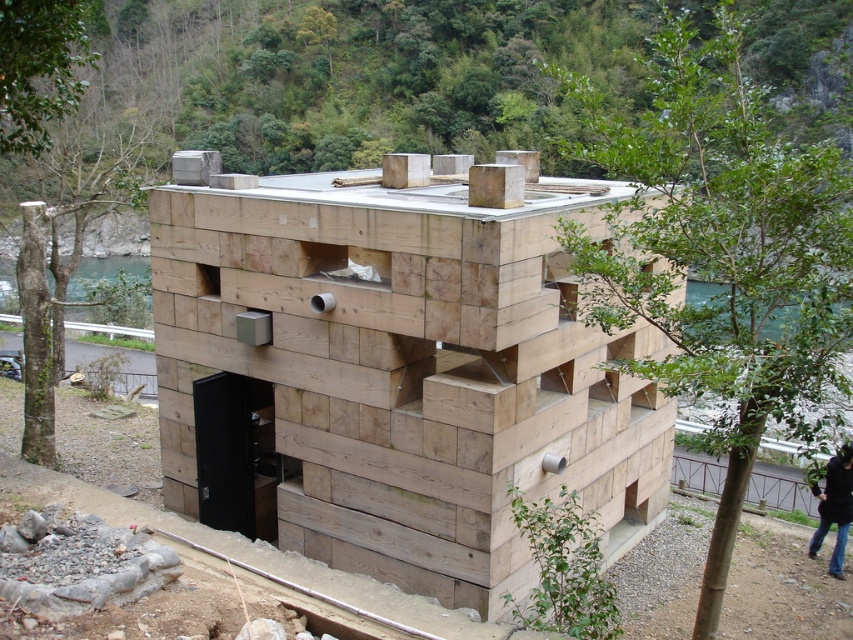
You are planning to take a photo of the natural wood house at center and the jeans at lower right. Which object should you focus on first if you want to capture both in one shot without zooming in or out?

The natural wood house at center is larger than the jeans at lower right, so you should focus on the natural wood house at center first to ensure it fits properly in the frame before adjusting for the smaller jeans at lower right.

In the scene shown: You are standing in front of the natural wood house at center and notice jeans at lower right. Which object is taller?

The natural wood house at center is much taller than the jeans at lower right.